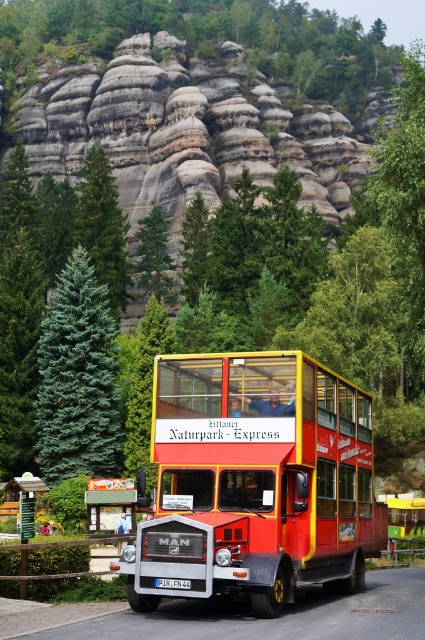
Question: Is the position of blue-green coniferous tree at left more distant than that of white plastic license plate at center?

Choices:
 (A) yes
 (B) no

Answer: (A)

Question: Which object is the closest to the white plastic license plate at center?

Choices:
 (A) blue-green coniferous tree at left
 (B) red matte double-decker bus at center

Answer: (B)

Question: Based on their relative distances, which object is nearer to the red matte double-decker bus at center?

Choices:
 (A) blue-green coniferous tree at left
 (B) white plastic license plate at center

Answer: (B)

Question: In this image, where is blue-green coniferous tree at left located relative to white plastic license plate at center?

Choices:
 (A) below
 (B) above

Answer: (B)

Question: Observing the image, what is the correct spatial positioning of blue-green coniferous tree at left in reference to white plastic license plate at center?

Choices:
 (A) below
 (B) above

Answer: (B)

Question: Which point is farther to the camera?

Choices:
 (A) (108, 371)
 (B) (155, 577)
 (C) (328, 428)

Answer: (A)